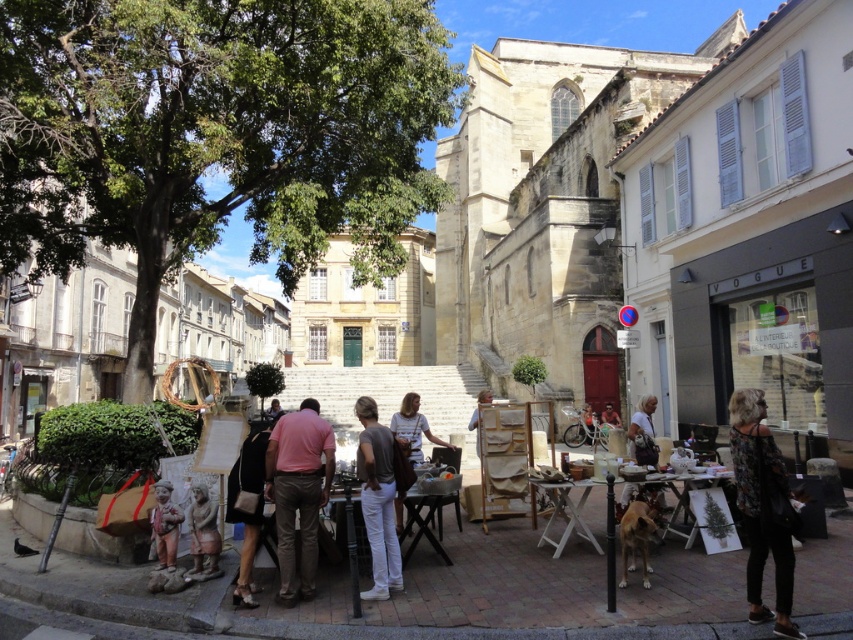
Identify the location of wooden crates at center. (416, 595).

Does wooden crates at center have a larger size compared to white textured shirt at center?

Yes, wooden crates at center is bigger than white textured shirt at center.

Identify the location of wooden crates at center. The width and height of the screenshot is (853, 640). (416, 595).

This screenshot has width=853, height=640. Find the location of `wooden crates at center`. wooden crates at center is located at coordinates (416, 595).

Which of these two, pink cotton shirt at center or leather handbag at lower left, stands taller?

With more height is pink cotton shirt at center.

At what (x,y) coordinates should I click in order to perform the action: click on pink cotton shirt at center. Please return your answer as a coordinate pair (x, y). This screenshot has height=640, width=853. Looking at the image, I should click on (299, 492).

Is point (306, 460) farther from camera compared to point (260, 492)?

No.

Identify the location of pink cotton shirt at center. The width and height of the screenshot is (853, 640). (299, 492).

In the scene shown: Does floral-patterned fabric at lower right appear on the left side of leather handbag at lower left?

Incorrect, floral-patterned fabric at lower right is not on the left side of leather handbag at lower left.

Which is below, floral-patterned fabric at lower right or leather handbag at lower left?

floral-patterned fabric at lower right is below.

Consider the image. Who is more forward, (775, 532) or (247, 442)?

Point (775, 532)

In order to click on floral-patterned fabric at lower right in this screenshot , I will do `click(762, 508)`.